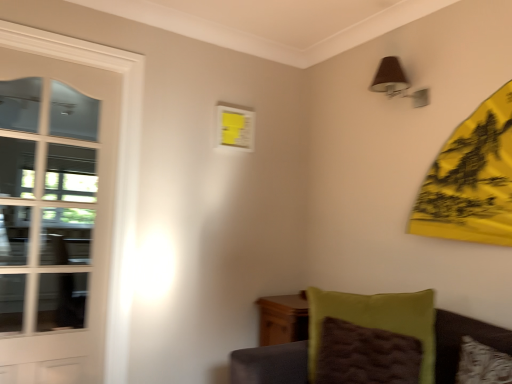
Question: From the image's perspective, does brown fabric lampshade at upper right appear lower than velvet green cushion at lower right?

Choices:
 (A) yes
 (B) no

Answer: (B)

Question: Does brown fabric lampshade at upper right have a greater width compared to velvet green cushion at lower right?

Choices:
 (A) no
 (B) yes

Answer: (A)

Question: Can you confirm if brown fabric lampshade at upper right is shorter than velvet green cushion at lower right?

Choices:
 (A) no
 (B) yes

Answer: (B)

Question: Does brown fabric lampshade at upper right come in front of velvet green cushion at lower right?

Choices:
 (A) no
 (B) yes

Answer: (A)

Question: Is brown fabric lampshade at upper right not within velvet green cushion at lower right?

Choices:
 (A) yes
 (B) no

Answer: (A)

Question: Is velvet green cushion at lower right surrounded by brown fabric lampshade at upper right?

Choices:
 (A) no
 (B) yes

Answer: (A)

Question: Does green fuzzy pillow at lower right lie in front of brown fabric lampshade at upper right?

Choices:
 (A) no
 (B) yes

Answer: (B)

Question: Is brown fabric lampshade at upper right at the back of green fuzzy pillow at lower right?

Choices:
 (A) yes
 (B) no

Answer: (B)

Question: Does green fuzzy pillow at lower right have a larger size compared to brown fabric lampshade at upper right?

Choices:
 (A) no
 (B) yes

Answer: (B)

Question: Is green fuzzy pillow at lower right aimed at brown fabric lampshade at upper right?

Choices:
 (A) yes
 (B) no

Answer: (B)

Question: Is green fuzzy pillow at lower right to the left of brown fabric lampshade at upper right from the viewer's perspective?

Choices:
 (A) yes
 (B) no

Answer: (A)

Question: From the image's perspective, does green fuzzy pillow at lower right appear lower than brown fabric lampshade at upper right?

Choices:
 (A) yes
 (B) no

Answer: (A)

Question: Is white glossy door at left far away from green fuzzy pillow at lower right?

Choices:
 (A) no
 (B) yes

Answer: (B)